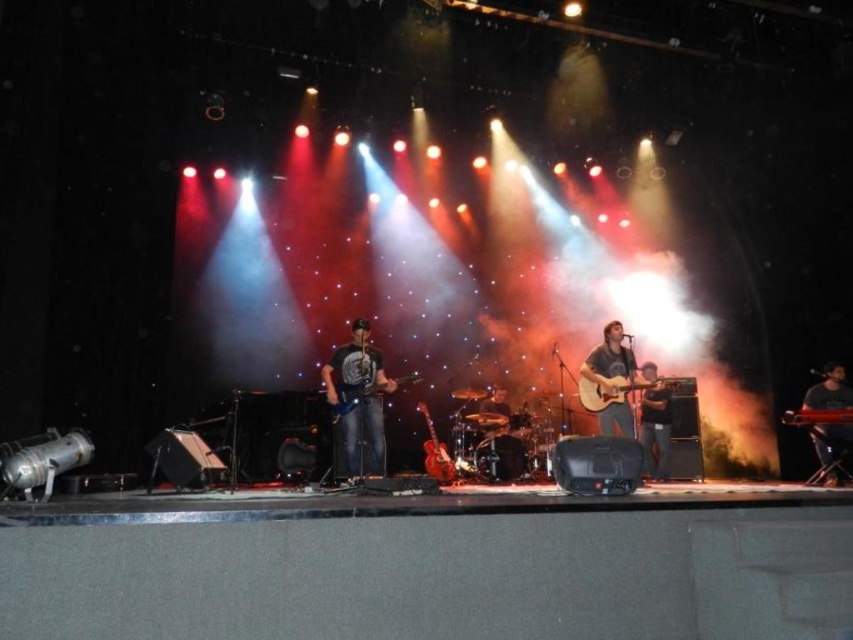
From the picture: You are a stagehand who needs to place a 1.2 meter high amplifier behind the shiny black guitar at center and the shiny brown electric guitar at center. Which guitar should the amplifier be placed behind to ensure it doesn

The shiny black guitar at center is much taller than the shiny brown electric guitar at center, so placing the amplifier behind the shiny black guitar at center would be more appropriate as it can accommodate the height of the amplifier without blocking the performer.